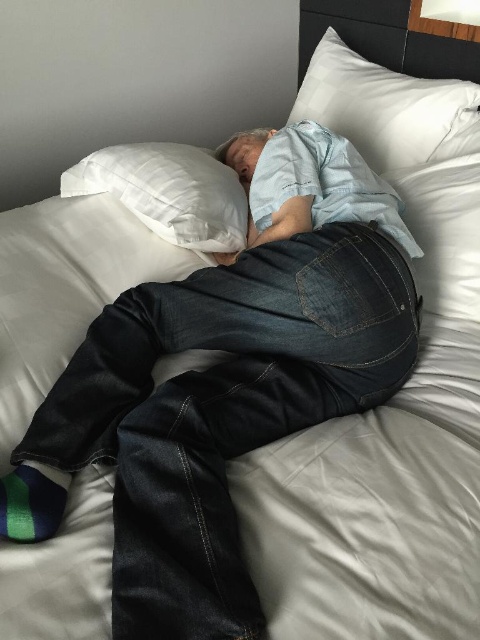
You are a nurse checking on a patient in a hospital room. You need to adjust the pillows to ensure the patient is comfortable. The bed has a white soft pillow at upper left and a multicolored fabric sock at lower left. Which object should you adjust first to improve the patient comfort?

The white soft pillow at upper left should be adjusted first since it is larger in size than the multicolored fabric sock at lower left and is likely supporting the patient more directly.

You are a delivery person who needs to place a small package between the white soft pillow at upper right and the white soft pillow at upper left on the bed. The package is 18 inches long. Will it fit between them?

The distance between the white soft pillow at upper right and the white soft pillow at upper left is 18.12 inches, so the 18 inch package will fit between them.